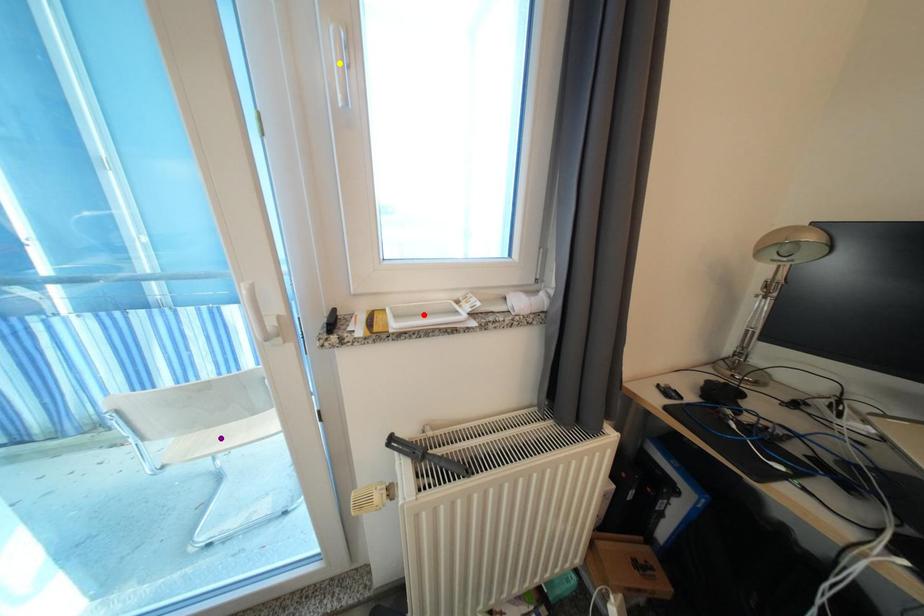
Looking at this image, order these from nearest to farthest:
- yellow point
- purple point
- red point

yellow point < red point < purple point